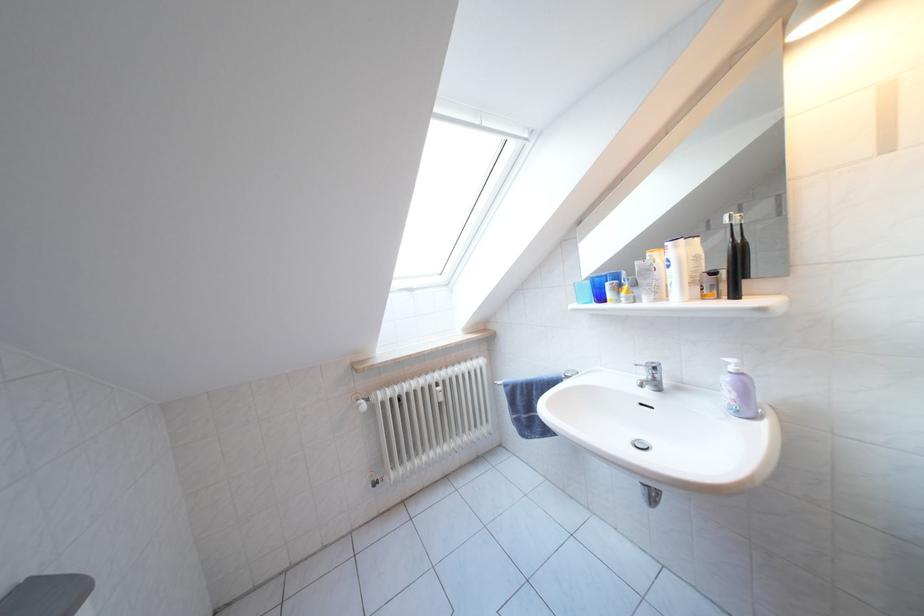
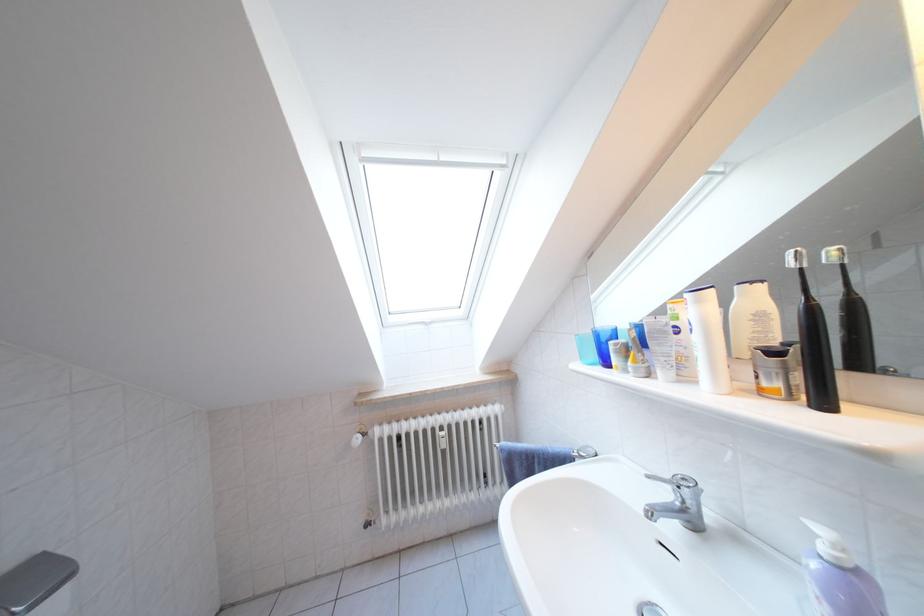
Where in the second image is the point corresponding to the point at 685,252 from the first image?

(708, 306)